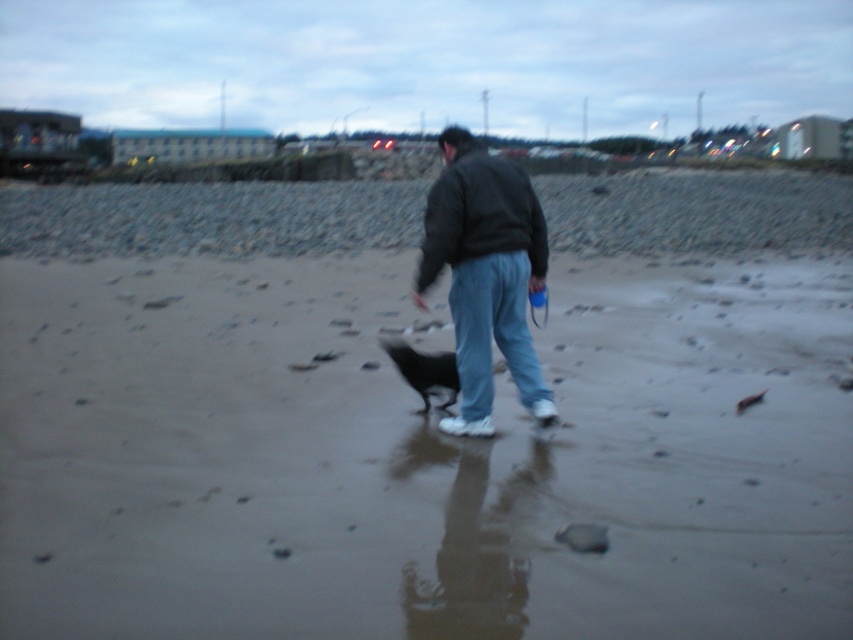
Question: Considering the relative positions of dark gray jacket at center and dark gray fleece sweatshirt at center in the image provided, where is dark gray jacket at center located with respect to dark gray fleece sweatshirt at center?

Choices:
 (A) above
 (B) below

Answer: (B)

Question: Is dark gray jacket at center to the right of black fur dog at center from the viewer's perspective?

Choices:
 (A) yes
 (B) no

Answer: (A)

Question: Which object is closer to the camera taking this photo?

Choices:
 (A) black fur dog at center
 (B) smooth sand beach at center
 (C) dark gray fleece sweatshirt at center

Answer: (B)

Question: Which object appears closest to the camera in this image?

Choices:
 (A) dark gray fleece sweatshirt at center
 (B) smooth sand beach at center
 (C) black fur dog at center
 (D) dark gray jacket at center

Answer: (B)

Question: Is dark gray fleece sweatshirt at center bigger than black fur dog at center?

Choices:
 (A) no
 (B) yes

Answer: (B)

Question: Which of these objects is positioned farthest from the dark gray fleece sweatshirt at center?

Choices:
 (A) black fur dog at center
 (B) dark gray jacket at center
 (C) smooth sand beach at center

Answer: (C)